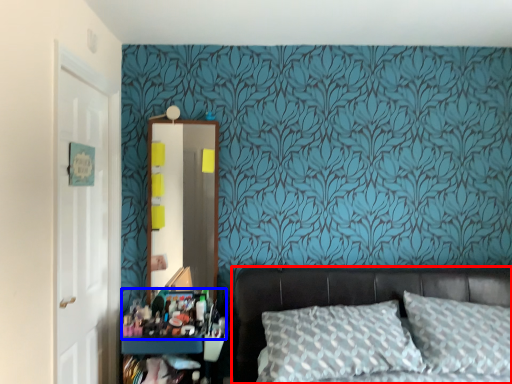
Question: Which object appears farthest to the camera in this image, bed (highlighted by a red box) or stuff (highlighted by a blue box)?

Choices:
 (A) bed
 (B) stuff

Answer: (B)